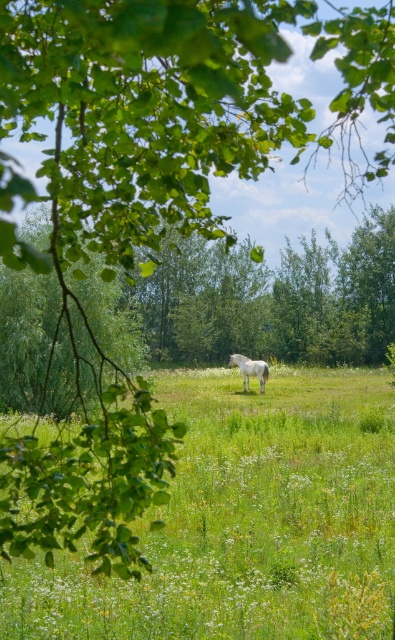
Question: Which of the following is the farthest from the observer?

Choices:
 (A) white glossy horse at center
 (B) green grassy pasture at center

Answer: (A)

Question: Is green grassy pasture at center smaller than white glossy horse at center?

Choices:
 (A) yes
 (B) no

Answer: (B)

Question: Does green grassy pasture at center appear over white glossy horse at center?

Choices:
 (A) yes
 (B) no

Answer: (B)

Question: Is green grassy pasture at center to the right of white glossy horse at center from the viewer's perspective?

Choices:
 (A) yes
 (B) no

Answer: (A)